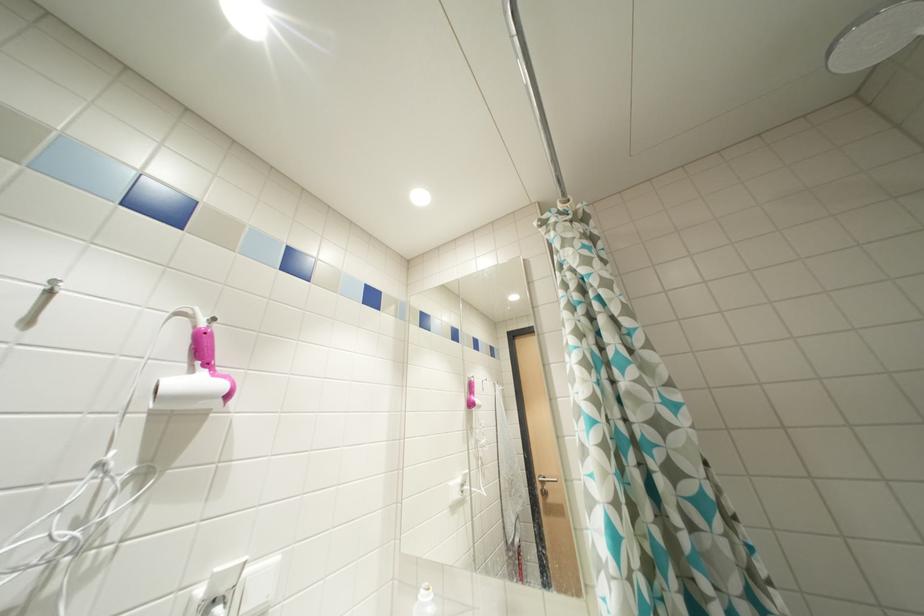
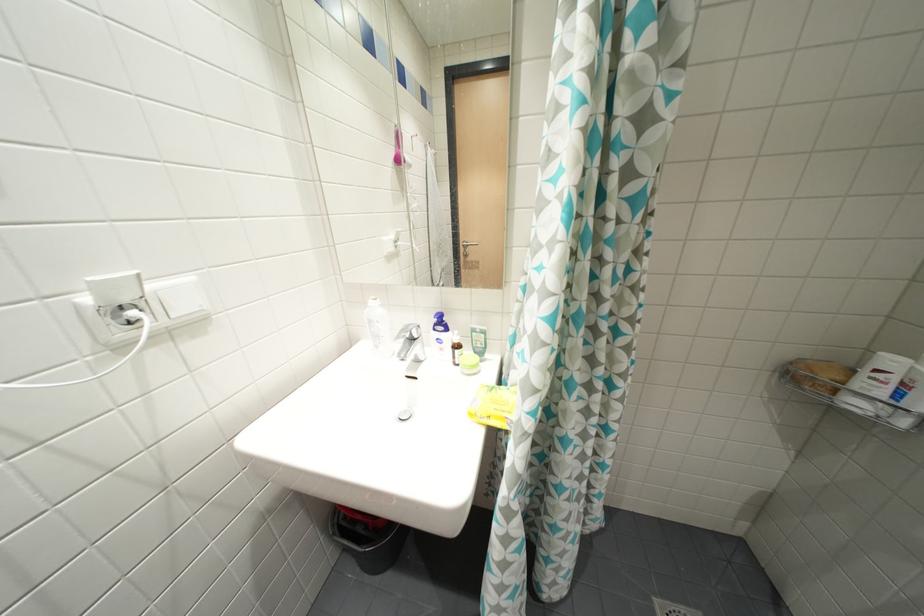
First-person continuous shooting, in which direction is the camera rotating?

The camera rotated toward right-down.